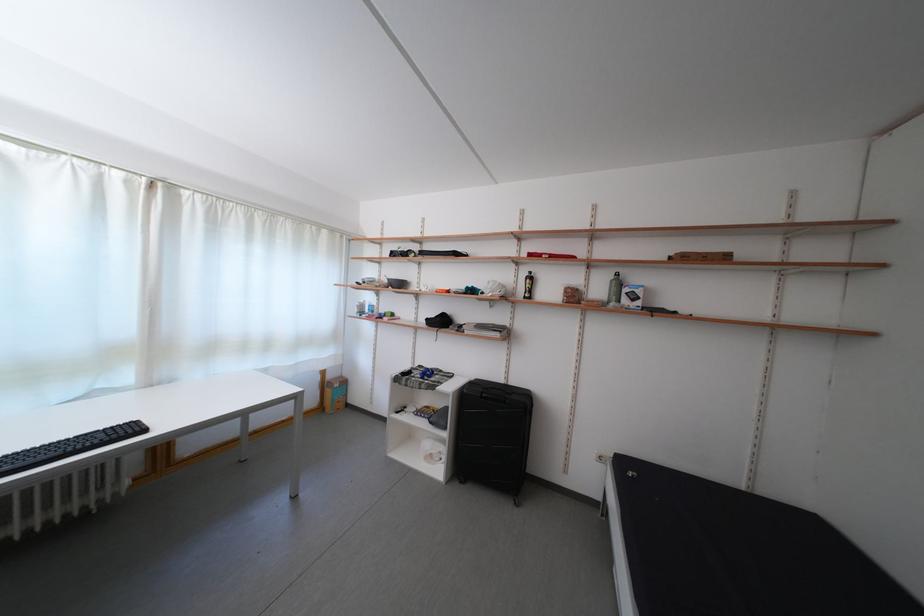
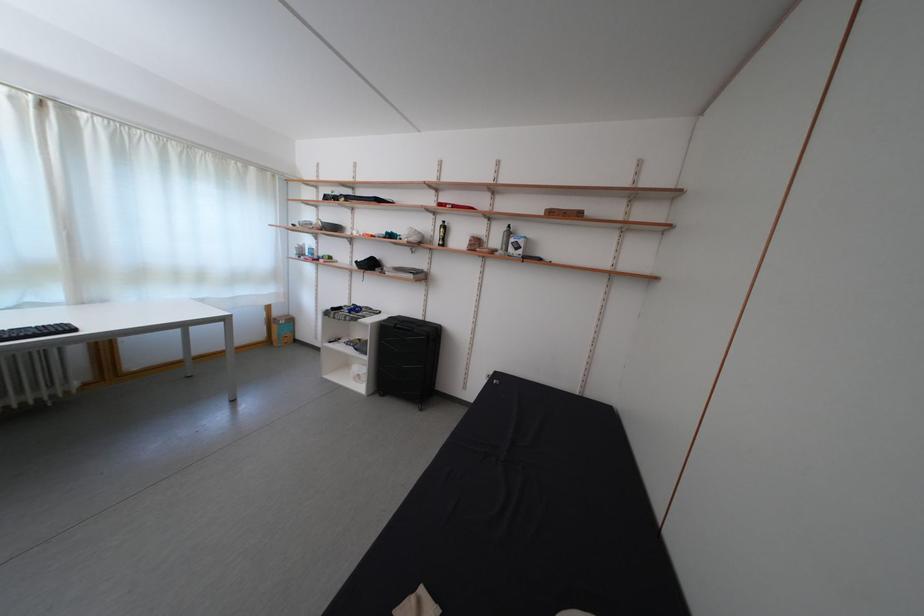
In the second image, find the point that corresponds to [439,460] in the first image.

(365, 381)